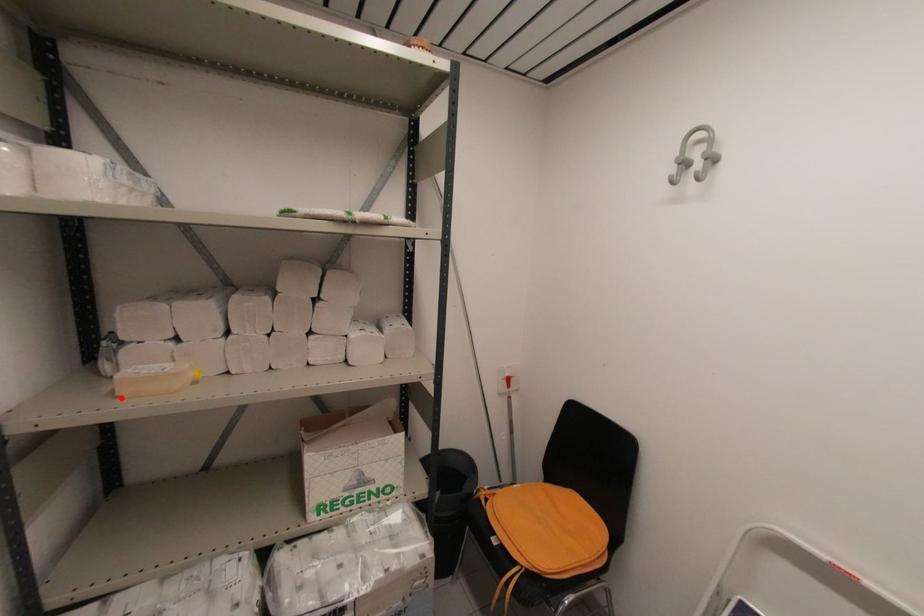
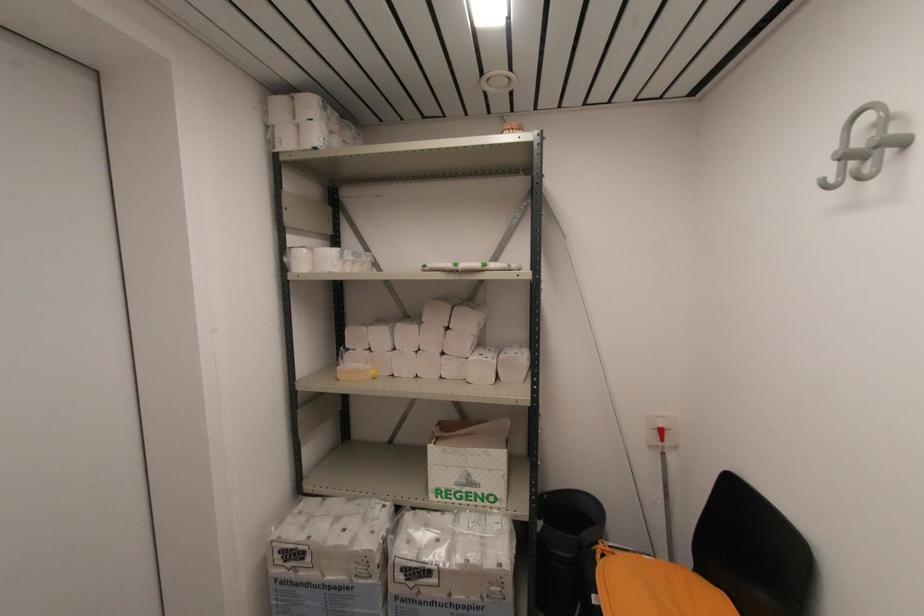
Find the pixel in the second image that matches the highlighted location in the first image.

(339, 381)